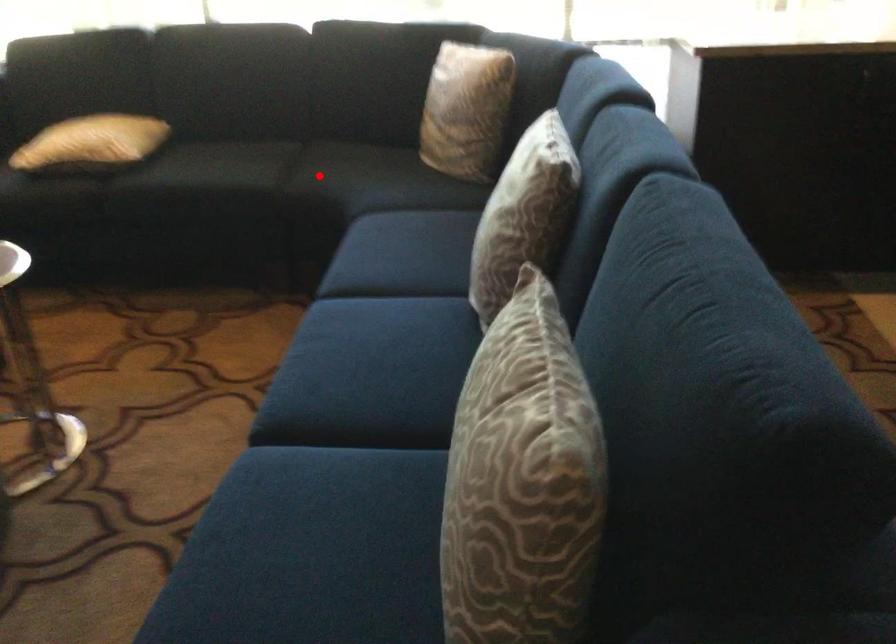
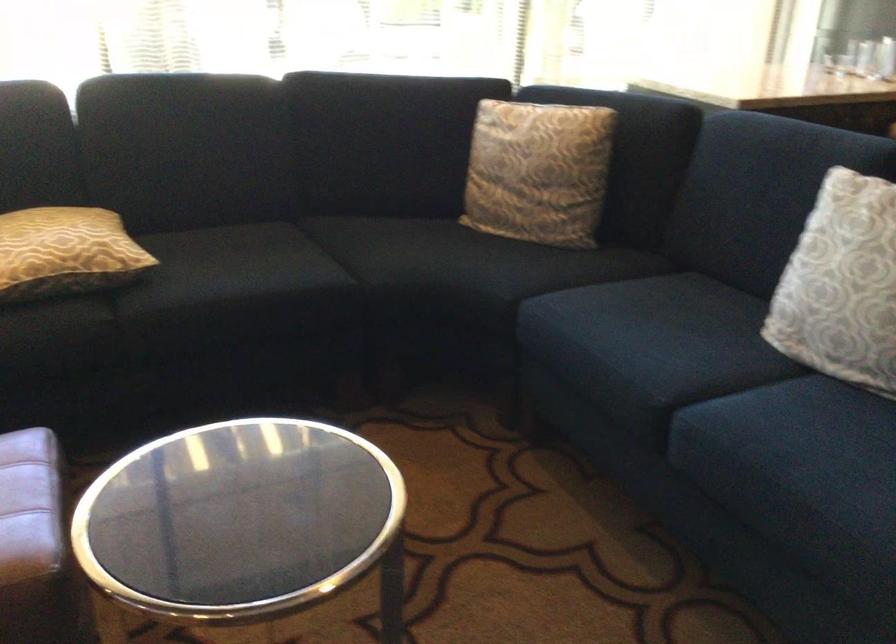
Question: I am providing you with two images of the same scene from different viewpoints. In image1, a red point is highlighted. Considering the same 3D point in image2, which of the following is correct?

Choices:
 (A) It is closer
 (B) It is farther

Answer: (A)